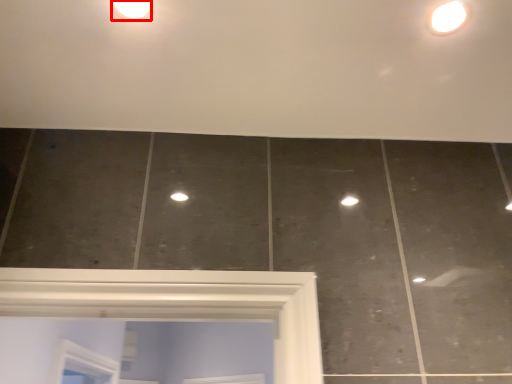
Question: From the image's perspective, what is the correct spatial positioning of droplight (annotated by the red box) in reference to light fixture?

Choices:
 (A) above
 (B) below

Answer: (A)